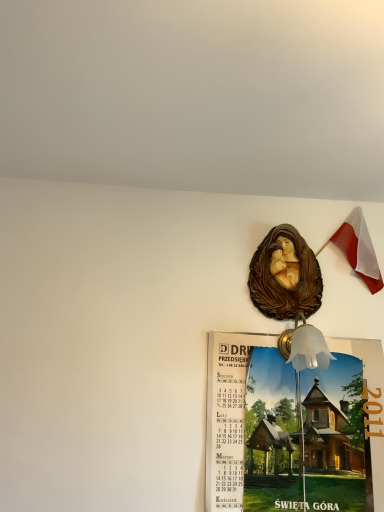
What do you see at coordinates (285, 275) in the screenshot?
I see `brown glossy statue at upper center` at bounding box center [285, 275].

Identify the location of wooden calendar at center. The width and height of the screenshot is (384, 512). pyautogui.click(x=293, y=426).

At what (x,y) coordinates should I click in order to perform the action: click on brown glossy statue at upper center. Please return your answer as a coordinate pair (x, y). Looking at the image, I should click on (285, 275).

How far apart are polish flag at upper right and brown glossy statue at upper center?

polish flag at upper right is 10.07 inches from brown glossy statue at upper center.

Which object is more forward, polish flag at upper right or brown glossy statue at upper center?

brown glossy statue at upper center is closer to the camera.

From the image's perspective, who appears lower, polish flag at upper right or brown glossy statue at upper center?

brown glossy statue at upper center is shown below in the image.

Is point (350, 248) closer to camera compared to point (277, 301)?

No, it is behind (277, 301).

Is wooden calendar at center closer to camera compared to brown glossy statue at upper center?

Yes, the depth of wooden calendar at center is less than that of brown glossy statue at upper center.

Is wooden calendar at center directly adjacent to brown glossy statue at upper center?

No, wooden calendar at center is not touching brown glossy statue at upper center.

Can you confirm if wooden calendar at center is taller than brown glossy statue at upper center?

Correct, wooden calendar at center is much taller as brown glossy statue at upper center.

Considering the sizes of objects wooden calendar at center and brown glossy statue at upper center in the image provided, who is wider, wooden calendar at center or brown glossy statue at upper center?

With larger width is brown glossy statue at upper center.

This screenshot has height=512, width=384. I want to click on poster page lying below the brown glossy statue at upper center (from the image's perspective), so click(293, 426).

Which of these two, brown glossy statue at upper center or wooden calendar at center, is thinner?

wooden calendar at center is thinner.

Is brown glossy statue at upper center taller or shorter than wooden calendar at center?

In the image, brown glossy statue at upper center appears to be shorter than wooden calendar at center.

Can you confirm if brown glossy statue at upper center is positioned to the left of polish flag at upper right?

Indeed, brown glossy statue at upper center is positioned on the left side of polish flag at upper right.

Is brown glossy statue at upper center looking in the opposite direction of polish flag at upper right?

No, brown glossy statue at upper center's orientation is not away from polish flag at upper right.

Between brown glossy statue at upper center and polish flag at upper right, which one has more height?

Standing taller between the two is polish flag at upper right.

Is brown glossy statue at upper center further to the viewer compared to polish flag at upper right?

No, brown glossy statue at upper center is closer to the camera.

From a real-world perspective, is polish flag at upper right positioned over wooden calendar at center based on gravity?

Indeed, from a real-world perspective, polish flag at upper right stands above wooden calendar at center.

Is polish flag at upper right oriented away from wooden calendar at center?

No, polish flag at upper right is not facing the opposite direction of wooden calendar at center.

In the scene shown: How many degrees apart are the facing directions of polish flag at upper right and wooden calendar at center?

There is a 0.241-degree angle between the facing directions of polish flag at upper right and wooden calendar at center.

Consider the image. From the image's perspective, is polish flag at upper right above or below wooden calendar at center?

polish flag at upper right is situated higher than wooden calendar at center in the image.

Is point (294, 487) closer to camera compared to point (344, 225)?

Yes, it is.

Is polish flag at upper right surrounded by wooden calendar at center?

Actually, polish flag at upper right is outside wooden calendar at center.

Where is `national flag that appears behind the wooden calendar at center`? The image size is (384, 512). national flag that appears behind the wooden calendar at center is located at coordinates (358, 249).

Identify the location of national flag above the brown glossy statue at upper center (from the image's perspective). The image size is (384, 512). (358, 249).

The width and height of the screenshot is (384, 512). I want to click on art on the right of wooden calendar at center, so click(x=285, y=275).

When comparing their distances from brown glossy statue at upper center, does wooden calendar at center or polish flag at upper right seem closer?

Among the two, polish flag at upper right is located nearer to brown glossy statue at upper center.

Based on their spatial positions, is polish flag at upper right or brown glossy statue at upper center closer to wooden calendar at center?

brown glossy statue at upper center is closer to wooden calendar at center.

Based on their spatial positions, is polish flag at upper right or wooden calendar at center closer to brown glossy statue at upper center?

polish flag at upper right lies closer to brown glossy statue at upper center than the other object.

Consider the image. Based on their spatial positions, is brown glossy statue at upper center or wooden calendar at center further from polish flag at upper right?

wooden calendar at center is further to polish flag at upper right.

Looking at the image, which one is located closer to polish flag at upper right, wooden calendar at center or brown glossy statue at upper center?

brown glossy statue at upper center is closer to polish flag at upper right.

Considering their positions, is brown glossy statue at upper center positioned further to wooden calendar at center than polish flag at upper right?

Among the two, polish flag at upper right is located further to wooden calendar at center.

You are a GUI agent. You are given a task and a screenshot of the screen. Output one action in this format:
    pyautogui.click(x=<x>, y=<y>)
    Task: Click on the art between polish flag at upper right and wooden calendar at center vertically
    The width and height of the screenshot is (384, 512).
    Given the screenshot: What is the action you would take?
    pyautogui.click(x=285, y=275)